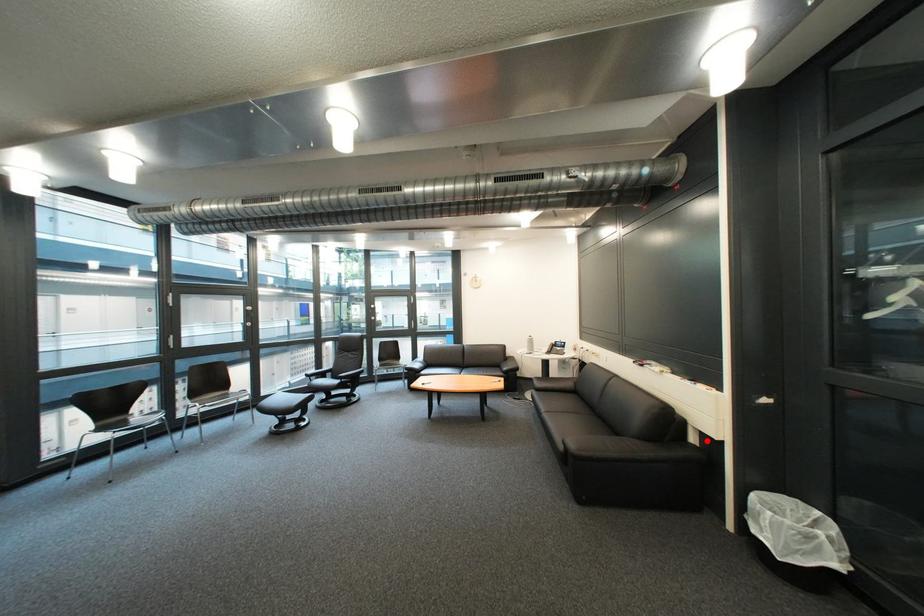
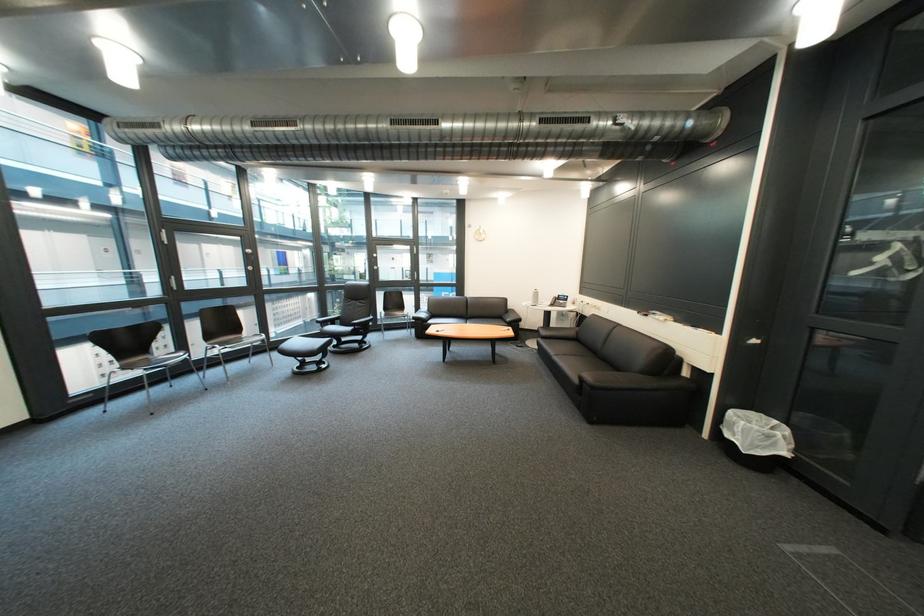
Find the pixel in the second image that matches the highlighted location in the first image.

(699, 375)